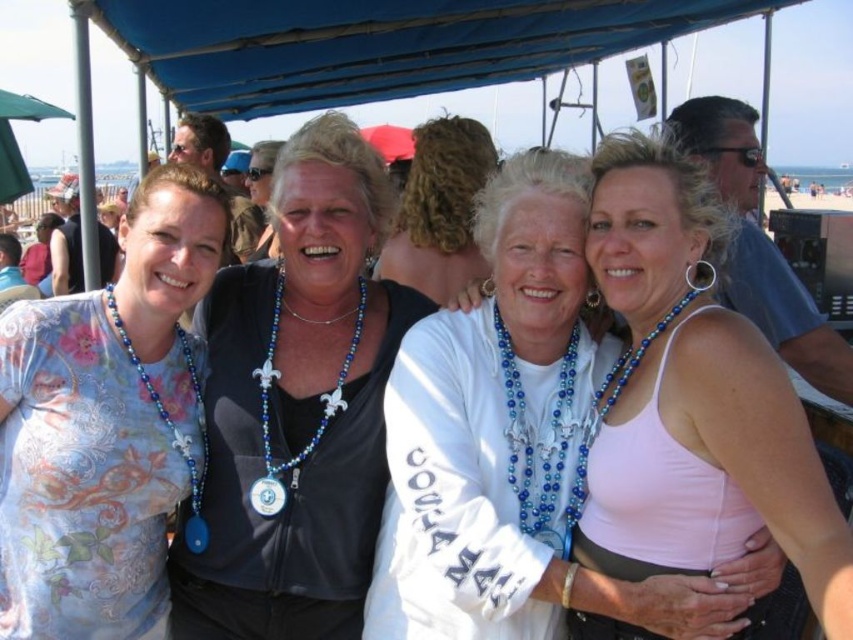
Is black leather jacket at center bigger than white matte shirt at center?

Incorrect, black leather jacket at center is not larger than white matte shirt at center.

Between black leather jacket at center and white matte shirt at center, which one is positioned higher?

black leather jacket at center is above.

Between point (376, 371) and point (402, 554), which one is positioned behind?

Positioned behind is point (376, 371).

I want to click on black leather jacket at center, so click(297, 404).

Does floral printed shirt at left have a lesser width compared to blue beaded necklace at center?

No.

Who is taller, floral printed shirt at left or blue beaded necklace at center?

floral printed shirt at left

Image resolution: width=853 pixels, height=640 pixels. Find the location of `floral printed shirt at left`. floral printed shirt at left is located at coordinates (103, 426).

At what (x,y) coordinates should I click in order to perform the action: click on floral printed shirt at left. Please return your answer as a coordinate pair (x, y). Looking at the image, I should click on (103, 426).

What do you see at coordinates (297, 404) in the screenshot? I see `black leather jacket at center` at bounding box center [297, 404].

Identify the location of black leather jacket at center. (297, 404).